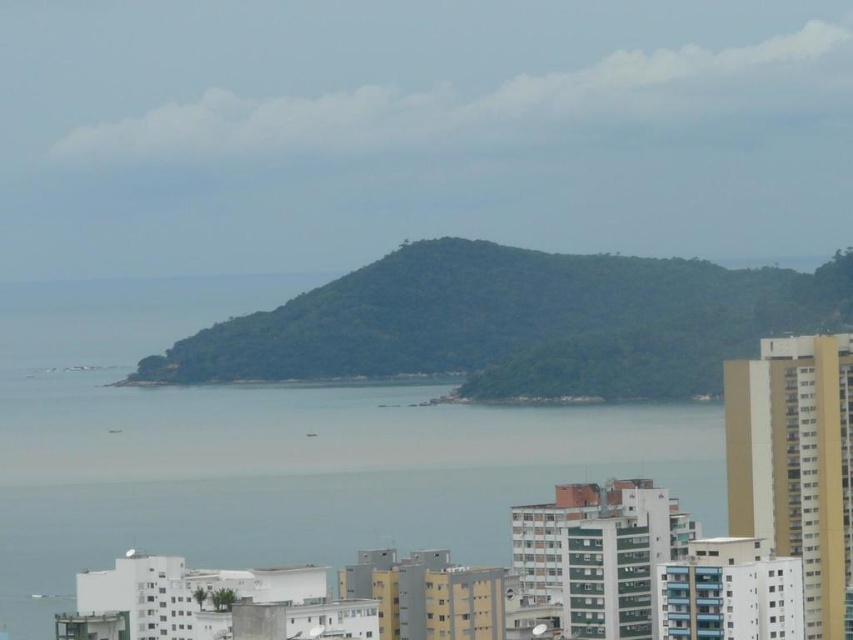
Question: Does clear blue water at center have a greater width compared to green leafy hill at center?

Choices:
 (A) no
 (B) yes

Answer: (B)

Question: Which point appears farthest from the camera in this image?

Choices:
 (A) (242, 324)
 (B) (335, 420)

Answer: (A)

Question: Does clear blue water at center have a lesser width compared to green leafy hill at center?

Choices:
 (A) no
 (B) yes

Answer: (A)

Question: Which point is closer to the camera taking this photo?

Choices:
 (A) (564, 436)
 (B) (300, 378)

Answer: (B)

Question: Does clear blue water at center appear on the left side of green leafy hill at center?

Choices:
 (A) yes
 (B) no

Answer: (A)